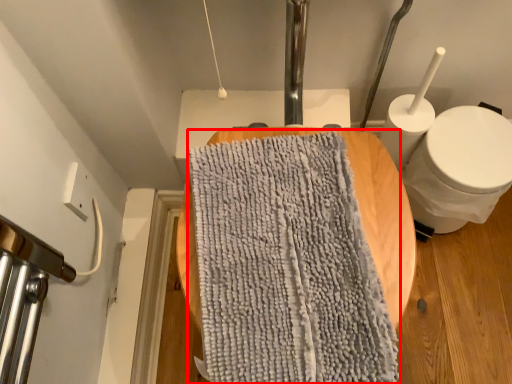
Question: From the image, what is the correct spatial relationship of bath towel (annotated by the red box) in relation to toilet?

Choices:
 (A) right
 (B) left

Answer: (B)